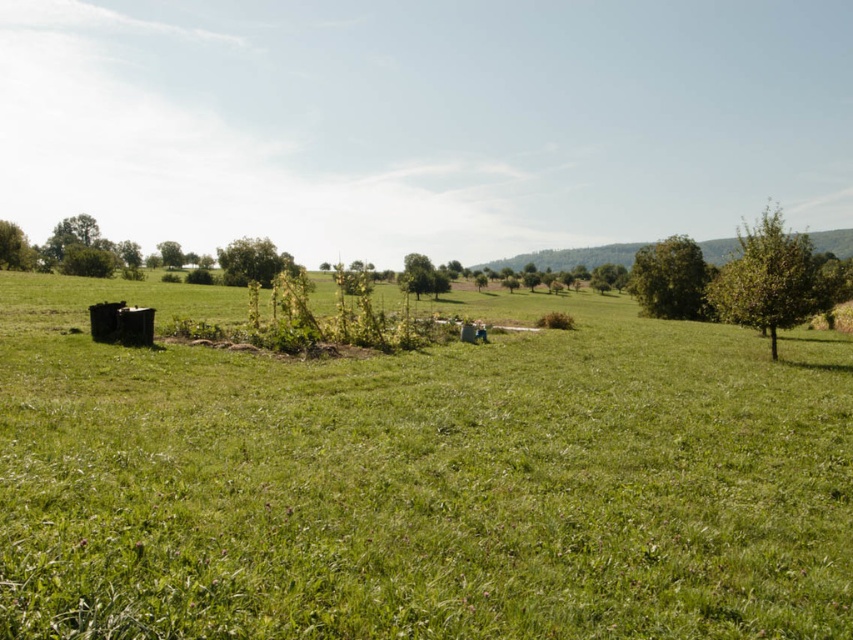
Question: Does green leafy tree at right appear under green leafy tree at center?

Choices:
 (A) no
 (B) yes

Answer: (A)

Question: Which of the following is the farthest from the observer?

Choices:
 (A) (7, 268)
 (B) (635, 257)

Answer: (A)

Question: Which of these objects is positioned farthest from the green leafy tree at right?

Choices:
 (A) green leafy tree at upper right
 (B) green grass pasture at center
 (C) green leafy tree at center

Answer: (C)

Question: Can you confirm if green leafy tree at right is thinner than green leafy tree at left?

Choices:
 (A) yes
 (B) no

Answer: (B)

Question: Considering the real-world distances, which object is closest to the green grass pasture at center?

Choices:
 (A) green leafy tree at upper right
 (B) green leafy tree at left
 (C) green leafy tree at right
 (D) green leafy tree at center

Answer: (C)

Question: Can you confirm if green leafy tree at upper right is positioned above green leafy tree at left?

Choices:
 (A) no
 (B) yes

Answer: (A)